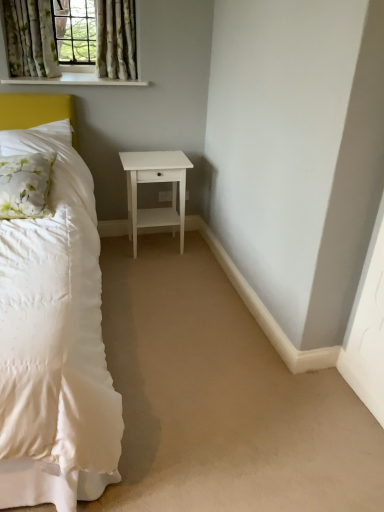
Question: Is white floral fabric pillow at left wider than white plastic electric outlet at center?

Choices:
 (A) yes
 (B) no

Answer: (A)

Question: From a real-world perspective, is white floral fabric pillow at left positioned under white plastic electric outlet at center based on gravity?

Choices:
 (A) no
 (B) yes

Answer: (A)

Question: From a real-world perspective, is white floral fabric pillow at left positioned over white plastic electric outlet at center based on gravity?

Choices:
 (A) yes
 (B) no

Answer: (A)

Question: From the image's perspective, is white floral fabric pillow at left below white plastic electric outlet at center?

Choices:
 (A) yes
 (B) no

Answer: (A)

Question: Does white floral fabric pillow at left contain white plastic electric outlet at center?

Choices:
 (A) yes
 (B) no

Answer: (B)

Question: Is point (34, 173) closer or farther from the camera than point (134, 206)?

Choices:
 (A) farther
 (B) closer

Answer: (B)

Question: From a real-world perspective, is white floral fabric pillow at left physically located above or below white matte nightstand at center?

Choices:
 (A) below
 (B) above

Answer: (B)

Question: Is white floral fabric pillow at left inside or outside of white matte nightstand at center?

Choices:
 (A) outside
 (B) inside

Answer: (A)

Question: Considering the relative positions of white floral fabric pillow at left and white matte nightstand at center in the image provided, is white floral fabric pillow at left to the left or to the right of white matte nightstand at center?

Choices:
 (A) right
 (B) left

Answer: (B)

Question: Considering the positions of floral fabric curtain at upper left, the 1th curtain in the right-to-left sequence, and white floral fabric pillow at left in the image, is floral fabric curtain at upper left, the 1th curtain in the right-to-left sequence, taller or shorter than white floral fabric pillow at left?

Choices:
 (A) tall
 (B) short

Answer: (A)

Question: Considering the positions of floral fabric curtain at upper left, the 1th curtain in the right-to-left sequence, and white floral fabric pillow at left in the image, is floral fabric curtain at upper left, the 1th curtain in the right-to-left sequence, wider or thinner than white floral fabric pillow at left?

Choices:
 (A) thin
 (B) wide

Answer: (A)

Question: Would you say floral fabric curtain at upper left, which is the 2th curtain in left-to-right order, is to the left or to the right of white floral fabric pillow at left in the picture?

Choices:
 (A) right
 (B) left

Answer: (A)

Question: Does point (135, 70) appear closer or farther from the camera than point (3, 164)?

Choices:
 (A) farther
 (B) closer

Answer: (A)

Question: From their relative heights in the image, would you say white plastic electric outlet at center is taller or shorter than white painted wood at upper left?

Choices:
 (A) tall
 (B) short

Answer: (A)

Question: From a real-world perspective, relative to white painted wood at upper left, is white plastic electric outlet at center vertically above or below?

Choices:
 (A) above
 (B) below

Answer: (B)